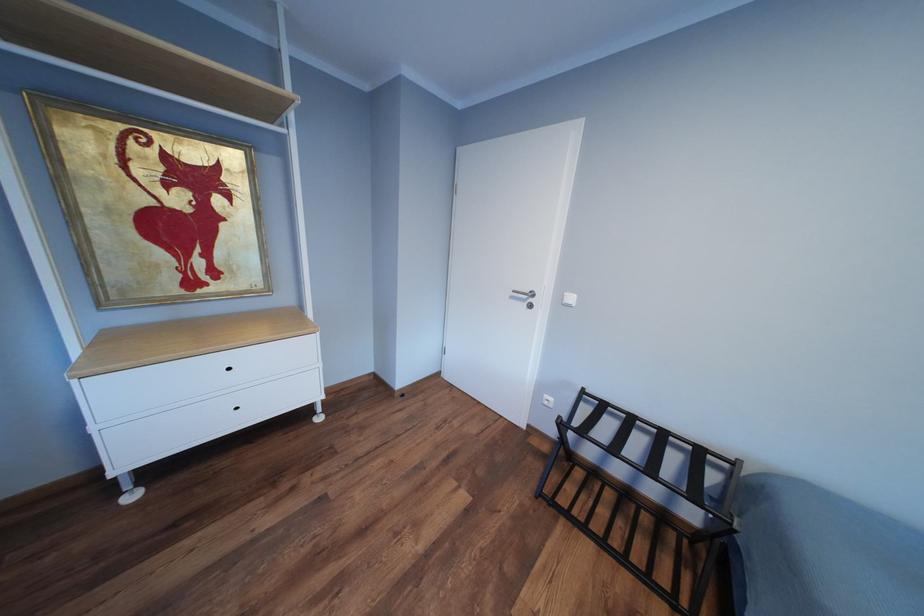
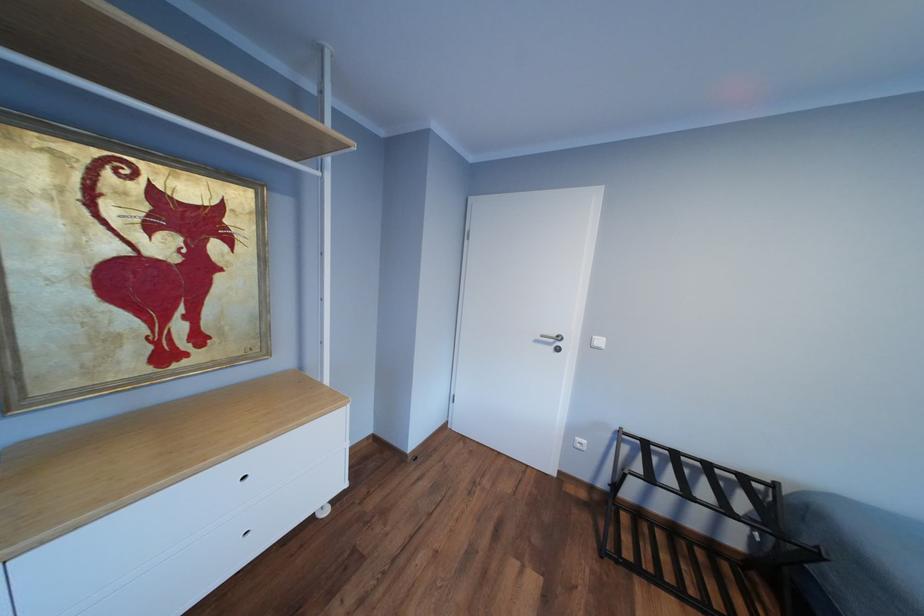
Question: The camera is either moving clockwise (left) or counter-clockwise (right) around the object. The first image is from the beginning of the video and the second image is from the end. Is the camera moving left or right when shooting the video?

Choices:
 (A) Left
 (B) Right

Answer: (A)